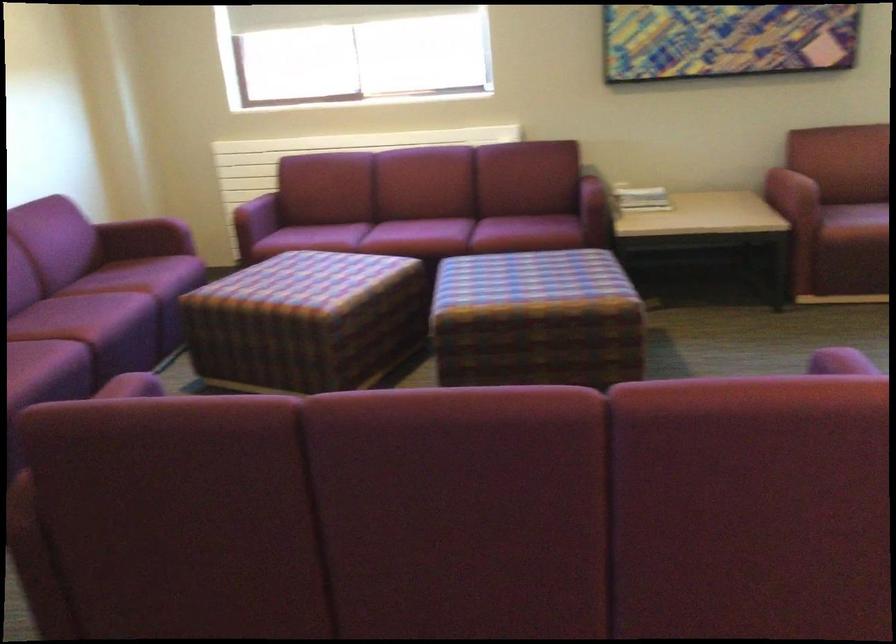
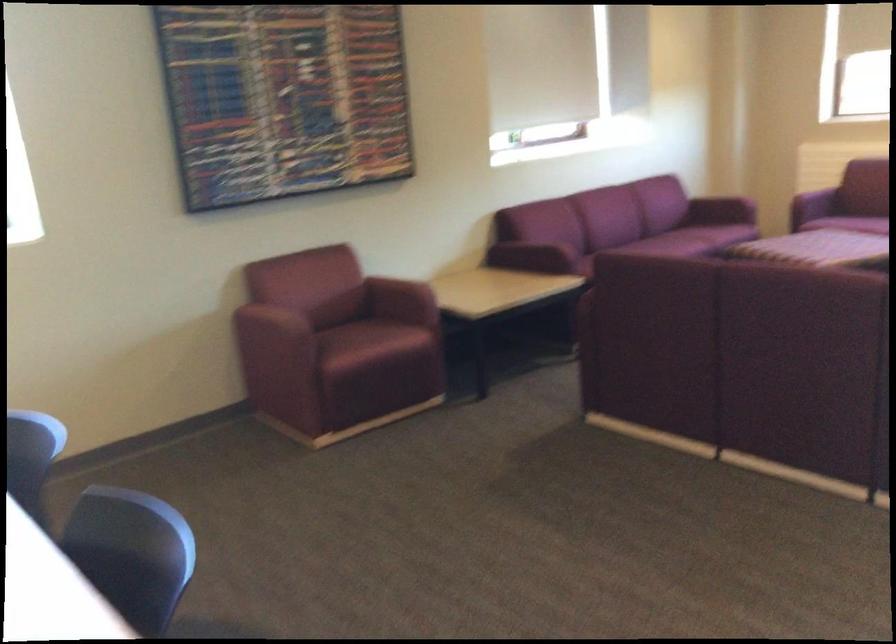
The point at (x=113, y=297) is marked in the first image. Where is the corresponding point in the second image?

(683, 242)